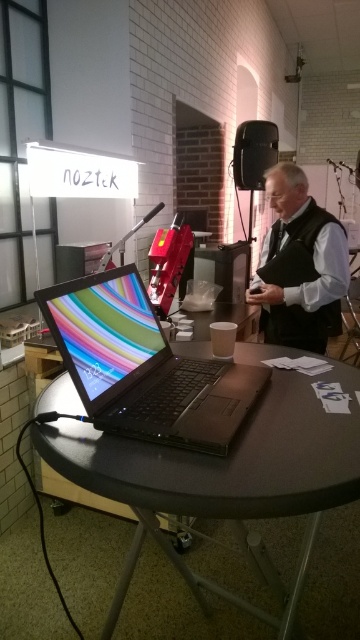
Which is more to the right, black plastic table at center or dark gray vest at center?

dark gray vest at center

Based on the photo, does black plastic table at center have a greater width compared to dark gray vest at center?

Yes, black plastic table at center is wider than dark gray vest at center.

Image resolution: width=360 pixels, height=640 pixels. What do you see at coordinates (225, 481) in the screenshot?
I see `black plastic table at center` at bounding box center [225, 481].

The height and width of the screenshot is (640, 360). Identify the location of black plastic table at center. (225, 481).

Can you confirm if black plastic table at center is positioned above shiny black laptop at center?

No, black plastic table at center is not above shiny black laptop at center.

Can you confirm if black plastic table at center is taller than shiny black laptop at center?

No, black plastic table at center is not taller than shiny black laptop at center.

You are a GUI agent. You are given a task and a screenshot of the screen. Output one action in this format:
    pyautogui.click(x=<x>, y=<y>)
    Task: Click on the black plastic table at center
    
    Given the screenshot: What is the action you would take?
    tap(225, 481)

Measure the distance from shiny black laptop at center to dark gray vest at center.

A distance of 3.90 feet exists between shiny black laptop at center and dark gray vest at center.

Can you confirm if shiny black laptop at center is smaller than dark gray vest at center?

Yes, shiny black laptop at center is smaller than dark gray vest at center.

Describe the element at coordinates (144, 365) in the screenshot. I see `shiny black laptop at center` at that location.

Where is `shiny black laptop at center`? This screenshot has width=360, height=640. shiny black laptop at center is located at coordinates (x=144, y=365).